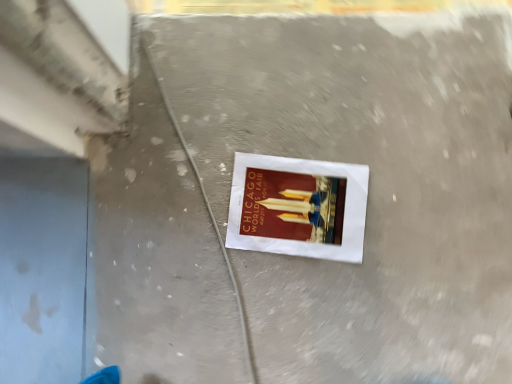
The height and width of the screenshot is (384, 512). Describe the element at coordinates (298, 207) in the screenshot. I see `white paper poster at center` at that location.

In order to face white paper poster at center, should I rotate leftwards or rightwards?

Turn right by 6.272 degrees to look at white paper poster at center.

The width and height of the screenshot is (512, 384). In order to click on white paper poster at center in this screenshot , I will do `click(298, 207)`.

Where is `white paper poster at center`? white paper poster at center is located at coordinates coord(298,207).